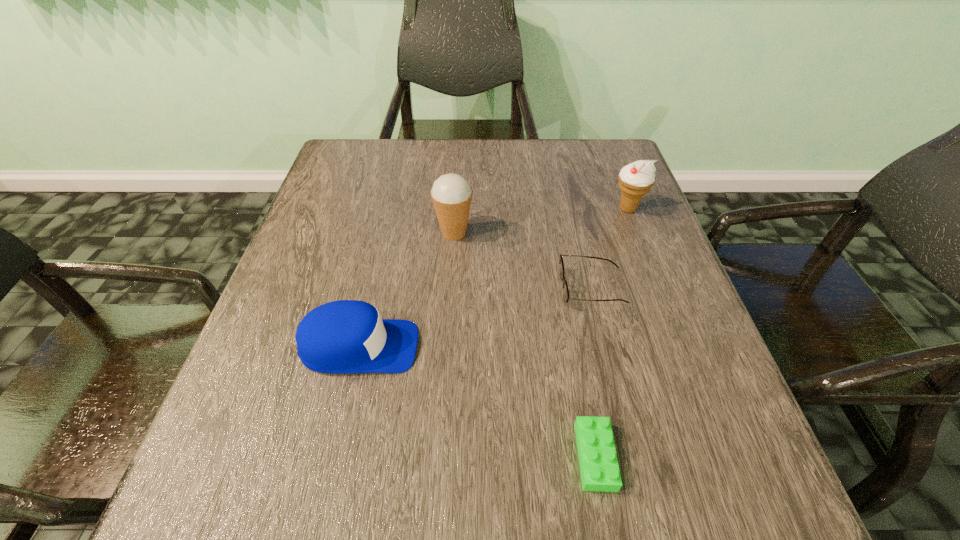
The height and width of the screenshot is (540, 960). I want to click on vacant area in the image that satisfies the following two spatial constraints: 1. on the back side of the Lego; 2. on the front-facing side of the baseball cap, so click(575, 347).

At what (x,y) coordinates should I click in order to perform the action: click on vacant space that satisfies the following two spatial constraints: 1. on the front side of the right icecream; 2. on the face of the second shortest object. Please return your answer as a coordinate pair (x, y). The image size is (960, 540). Looking at the image, I should click on (658, 288).